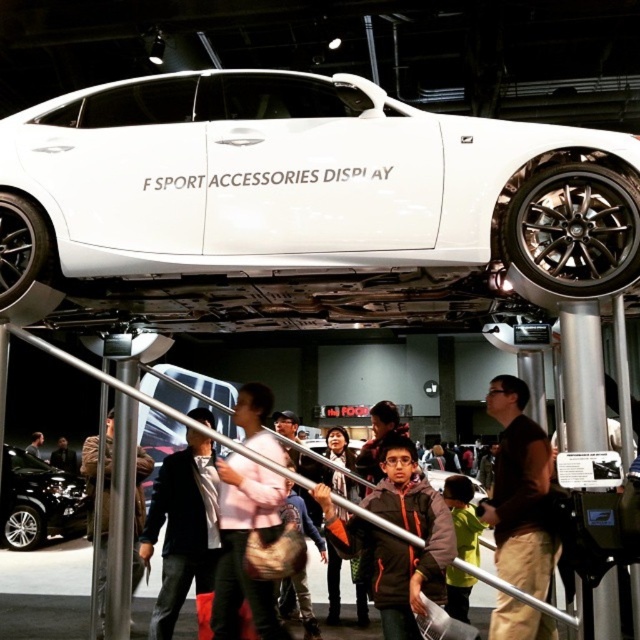
You are an attendee at the auto show and you want to get a better look at the white car on display. There are two jackets in your way. Which jacket, the brown leather jacket at center or the dark brown leather jacket at lower center, is closer to you and blocking your view?

The brown leather jacket at center is closer to you and blocking your view because it is in front of the dark brown leather jacket at lower center.